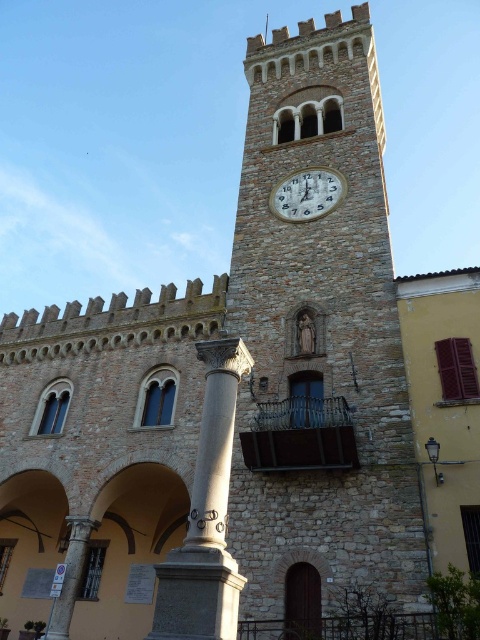
Between smooth stone column at center and white glossy clock at center, which one appears on the left side from the viewer's perspective?

From the viewer's perspective, smooth stone column at center appears more on the left side.

Between smooth stone column at center and white glossy clock at center, which one is positioned lower?

smooth stone column at center is lower down.

I want to click on smooth stone column at center, so (x=205, y=515).

This screenshot has height=640, width=480. Find the location of `smooth stone column at center`. smooth stone column at center is located at coordinates (205, 515).